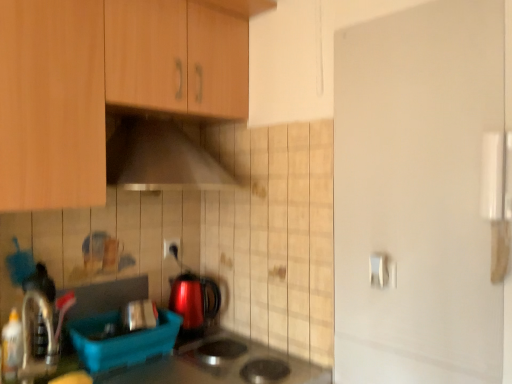
Question: Would you say glossy metallic kettle at center is part of metallic silver toaster at lower center, which is the second appliance in front-to-back order,'s contents?

Choices:
 (A) no
 (B) yes

Answer: (A)

Question: Considering the relative sizes of metallic silver toaster at lower center, which is the second appliance in front-to-back order, and glossy metallic kettle at center in the image provided, is metallic silver toaster at lower center, which is the second appliance in front-to-back order, smaller than glossy metallic kettle at center?

Choices:
 (A) yes
 (B) no

Answer: (A)

Question: Is metallic silver toaster at lower center, the first appliance from the back, shorter than glossy metallic kettle at center?

Choices:
 (A) no
 (B) yes

Answer: (B)

Question: Considering the relative sizes of metallic silver toaster at lower center, which is the second appliance in front-to-back order, and glossy metallic kettle at center in the image provided, is metallic silver toaster at lower center, which is the second appliance in front-to-back order, bigger than glossy metallic kettle at center?

Choices:
 (A) no
 (B) yes

Answer: (A)

Question: Is metallic silver toaster at lower center, which is the second appliance in front-to-back order, facing towards glossy metallic kettle at center?

Choices:
 (A) no
 (B) yes

Answer: (A)

Question: Can you confirm if metallic silver toaster at lower center, the first appliance from the back, is taller than glossy metallic kettle at center?

Choices:
 (A) no
 (B) yes

Answer: (A)

Question: Is white glossy door handle at upper right positioned before white plastic electric outlet at center?

Choices:
 (A) no
 (B) yes

Answer: (B)

Question: Is white glossy door handle at upper right not close to white plastic electric outlet at center?

Choices:
 (A) no
 (B) yes

Answer: (A)

Question: Does white glossy door handle at upper right have a greater height compared to white plastic electric outlet at center?

Choices:
 (A) no
 (B) yes

Answer: (A)

Question: Is white glossy door handle at upper right outside of white plastic electric outlet at center?

Choices:
 (A) yes
 (B) no

Answer: (A)

Question: Considering the relative sizes of white glossy door handle at upper right and white plastic electric outlet at center in the image provided, is white glossy door handle at upper right thinner than white plastic electric outlet at center?

Choices:
 (A) yes
 (B) no

Answer: (A)

Question: Does white glossy door handle at upper right lie behind white plastic electric outlet at center?

Choices:
 (A) no
 (B) yes

Answer: (A)

Question: Are wooden cabinet at upper left and glossy metallic kettle at center located far from each other?

Choices:
 (A) yes
 (B) no

Answer: (B)